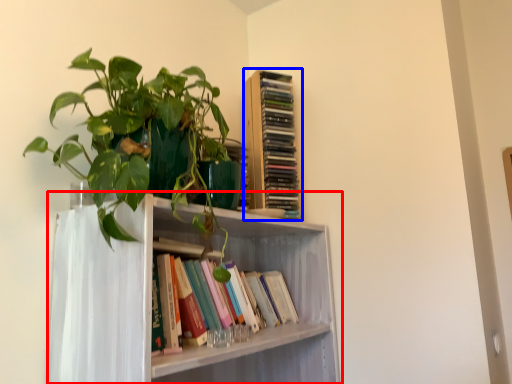
Question: Among these objects, which one is nearest to the camera, shelf (highlighted by a red box) or book (highlighted by a blue box)?

Choices:
 (A) shelf
 (B) book

Answer: (A)